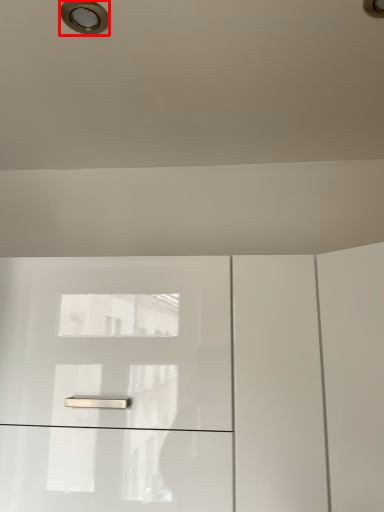
Question: From the image's perspective, what is the correct spatial positioning of droplight (annotated by the red box) in reference to dresser?

Choices:
 (A) below
 (B) above

Answer: (B)